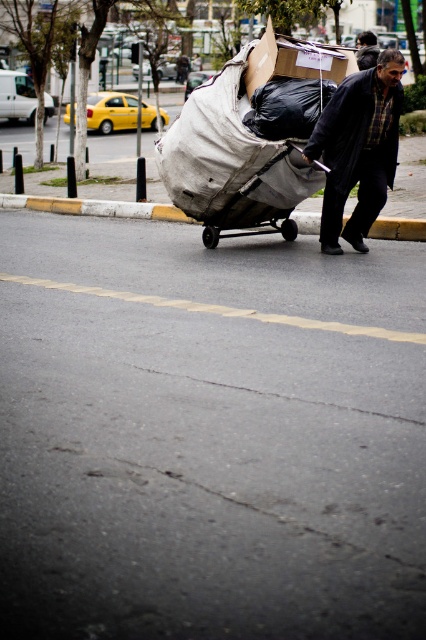
You are a pedestrian standing at point (247, 76) and want to walk to point (368, 157). Is there a clear path between these two points without any obstacles?

Yes, there is a clear path between point (368, 157) and point (247, 76) since the first point is in front of the second point, indicating no obstruction between them.

You are a pedestrian standing at the point labeled as point (359, 148) in the image. What object are you directly standing on?

The point (359, 148) corresponds to the dark blue jacket at center, so you are directly standing on the dark blue jacket at center.